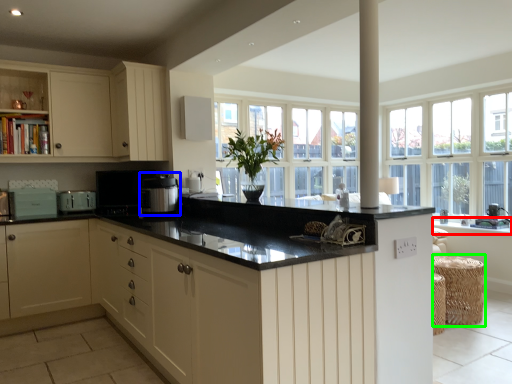
Question: Which is farther away from window sill (highlighted by a red box)? appliance (highlighted by a blue box) or bar stool (highlighted by a green box)?

Choices:
 (A) appliance
 (B) bar stool

Answer: (A)